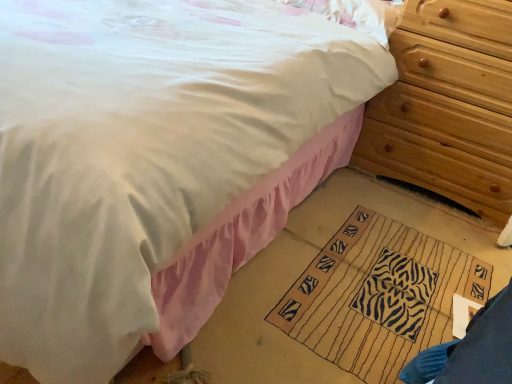
Question: Considering the relative sizes of beige woven mat at lower center and wooden chest of drawers at right in the image provided, is beige woven mat at lower center wider than wooden chest of drawers at right?

Choices:
 (A) yes
 (B) no

Answer: (A)

Question: Can you confirm if beige woven mat at lower center is smaller than wooden chest of drawers at right?

Choices:
 (A) no
 (B) yes

Answer: (B)

Question: From the image's perspective, is beige woven mat at lower center located above wooden chest of drawers at right?

Choices:
 (A) no
 (B) yes

Answer: (A)

Question: From a real-world perspective, is beige woven mat at lower center physically below wooden chest of drawers at right?

Choices:
 (A) no
 (B) yes

Answer: (B)

Question: Does beige woven mat at lower center have a greater height compared to wooden chest of drawers at right?

Choices:
 (A) no
 (B) yes

Answer: (A)

Question: From the image's perspective, is beige woven mat at lower center below wooden chest of drawers at right?

Choices:
 (A) no
 (B) yes

Answer: (B)

Question: Does wooden chest of drawers at right come in front of beige woven mat at lower center?

Choices:
 (A) no
 (B) yes

Answer: (A)

Question: Considering the relative sizes of wooden chest of drawers at right and beige woven mat at lower center in the image provided, is wooden chest of drawers at right wider than beige woven mat at lower center?

Choices:
 (A) yes
 (B) no

Answer: (B)

Question: From a real-world perspective, is wooden chest of drawers at right positioned under beige woven mat at lower center based on gravity?

Choices:
 (A) no
 (B) yes

Answer: (A)

Question: From the image's perspective, does wooden chest of drawers at right appear lower than beige woven mat at lower center?

Choices:
 (A) yes
 (B) no

Answer: (B)

Question: Could you tell me if wooden chest of drawers at right is turned towards beige woven mat at lower center?

Choices:
 (A) no
 (B) yes

Answer: (B)

Question: Considering the relative sizes of wooden chest of drawers at right and beige woven mat at lower center in the image provided, is wooden chest of drawers at right taller than beige woven mat at lower center?

Choices:
 (A) yes
 (B) no

Answer: (A)

Question: Are wooden chest of drawers at right and white satin pillow at upper center far apart?

Choices:
 (A) yes
 (B) no

Answer: (B)